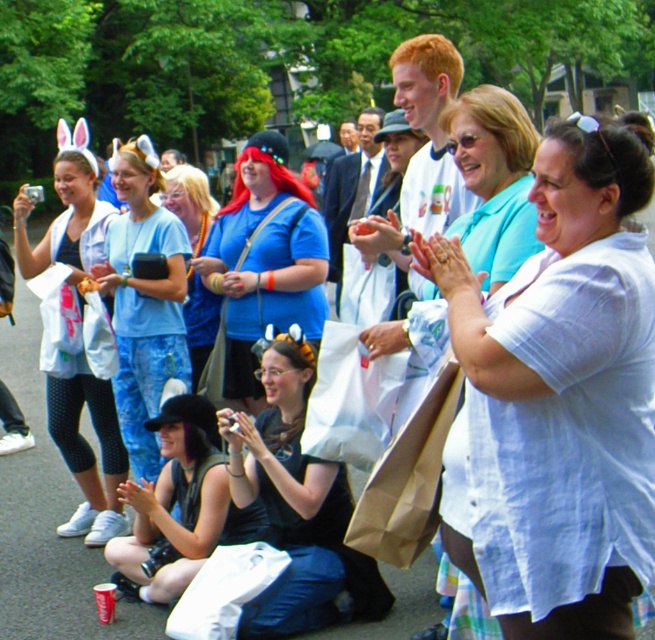
Based on the photo, can you confirm if white cotton shirt at center is thinner than matte white jacket at center?

Incorrect, white cotton shirt at center's width is not less than matte white jacket at center's.

Is white cotton shirt at center bigger than matte white jacket at center?

Correct, white cotton shirt at center is larger in size than matte white jacket at center.

Locate an element on the screen. This screenshot has width=655, height=640. white cotton shirt at center is located at coordinates (559, 396).

You are a GUI agent. You are given a task and a screenshot of the screen. Output one action in this format:
    pyautogui.click(x=<x>, y=<y>)
    Task: Click on the white cotton shirt at center
    
    Given the screenshot: What is the action you would take?
    pyautogui.click(x=559, y=396)

Is white cotton shirt at center thinner than light blue denim jeans at center?

Incorrect, white cotton shirt at center's width is not less than light blue denim jeans at center's.

Which of these two, white cotton shirt at center or light blue denim jeans at center, stands taller?

With more height is light blue denim jeans at center.

Find the location of a particular element. The image size is (655, 640). white cotton shirt at center is located at coordinates (559, 396).

Find the location of `white cotton shirt at center`. white cotton shirt at center is located at coordinates (559, 396).

Image resolution: width=655 pixels, height=640 pixels. What do you see at coordinates (262, 266) in the screenshot? I see `blue matte shirt at center` at bounding box center [262, 266].

Is point (263, 152) more distant than point (126, 424)?

No, it is in front of (126, 424).

Which is in front, point (215, 276) or point (143, 397)?

Point (215, 276) is in front.

The image size is (655, 640). What are the coordinates of `blue matte shirt at center` in the screenshot? It's located at (262, 266).